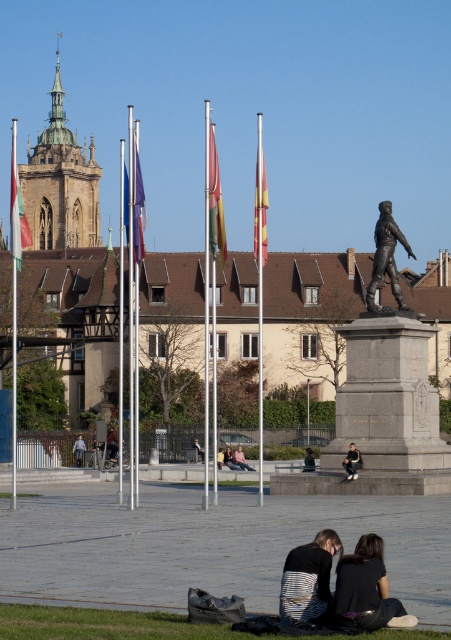
Between polished silver flagpole at center and green fabric flag at upper left, which one appears on the left side from the viewer's perspective?

green fabric flag at upper left is more to the left.

Between polished silver flagpole at center and green fabric flag at upper left, which one is positioned lower?

Positioned lower is polished silver flagpole at center.

Locate an element on the screen. The width and height of the screenshot is (451, 640). polished silver flagpole at center is located at coordinates (259, 282).

The image size is (451, 640). In order to click on polished silver flagpole at center in this screenshot , I will do `click(259, 282)`.

In the scene shown: Is bronze statue at center right taller than yellow fabric flag at center?

Incorrect, bronze statue at center right's height is not larger of yellow fabric flag at center's.

Does bronze statue at center right come in front of yellow fabric flag at center?

No, it is behind yellow fabric flag at center.

Does point (396, 371) come in front of point (263, 214)?

No, it is behind (263, 214).

At what (x,y) coordinates should I click in order to perform the action: click on bronze statue at center right. Please return your answer as a coordinate pair (x, y). This screenshot has width=451, height=640. Looking at the image, I should click on (387, 376).

Identify the location of green fabric flag at upper left. This screenshot has width=451, height=640. (17, 209).

Is the position of green fabric flag at upper left more distant than that of yellow fabric flag at center?

No, green fabric flag at upper left is closer to the viewer.

Locate an element on the screen. green fabric flag at upper left is located at coordinates (17, 209).